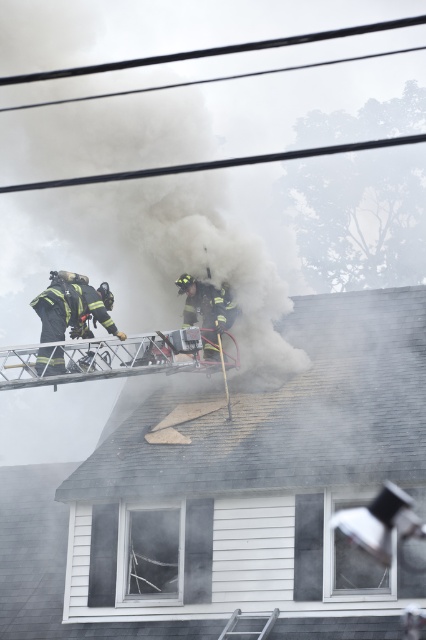
Question: Does gray shingles at upper center appear on the left side of black matte fireman at upper left?

Choices:
 (A) yes
 (B) no

Answer: (B)

Question: Does white fluffy smoke at center have a smaller size compared to silver metallic ladder at lower center?

Choices:
 (A) yes
 (B) no

Answer: (B)

Question: Is the position of white fluffy smoke at center more distant than that of black matte fireman at upper left?

Choices:
 (A) no
 (B) yes

Answer: (B)

Question: Which is nearer to the gray shingles at upper center?

Choices:
 (A) white fluffy smoke at center
 (B) silver metallic ladder at lower center

Answer: (B)

Question: Which object appears closest to the camera in this image?

Choices:
 (A) gray shingles at upper center
 (B) silver metallic ladder at lower center
 (C) black matte fireman at upper left

Answer: (B)

Question: Based on their relative distances, which object is nearer to the dark gray uniform at center?

Choices:
 (A) silver metallic ladder at lower center
 (B) white fluffy smoke at center
 (C) black matte fireman at upper left
 (D) gray shingles at upper center

Answer: (C)